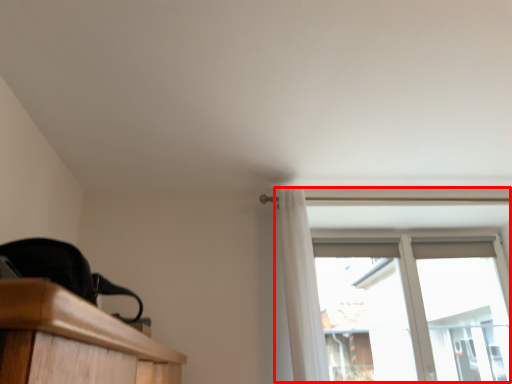
Question: From the image, what is the correct spatial relationship of window (annotated by the red box) in relation to curtain?

Choices:
 (A) left
 (B) right

Answer: (B)